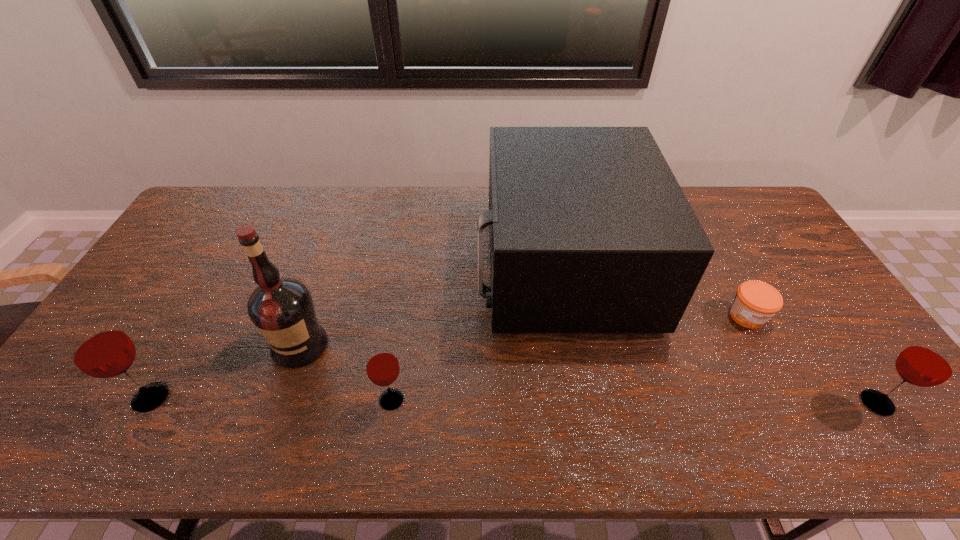
To make them evenly spaced by inserting another glass_(drink_container) among them, please locate a free space for this new glass_(drink_container). Please provide its 2D coordinates. Your answer should be formatted as a tuple, i.e. [(x, y)], where the tuple contains the x and y coordinates of a point satisfying the conditions above.

[(634, 401)]